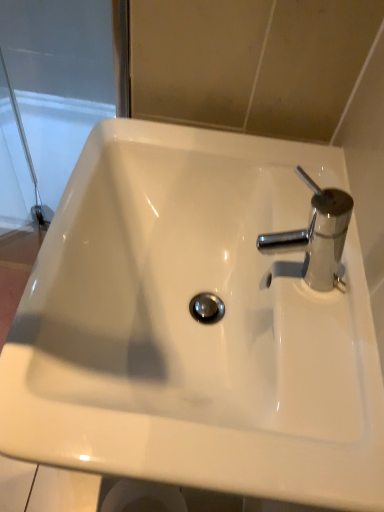
The height and width of the screenshot is (512, 384). Identify the location of free spot in front of chrome metallic faucet at upper right. (291, 356).